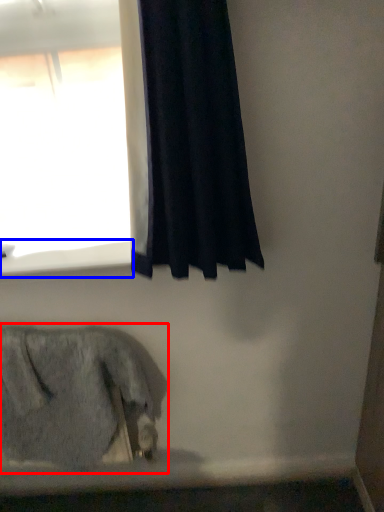
Question: Which of the following is the farthest to the observer, animal (highlighted by a red box) or window sill (highlighted by a blue box)?

Choices:
 (A) animal
 (B) window sill

Answer: (B)